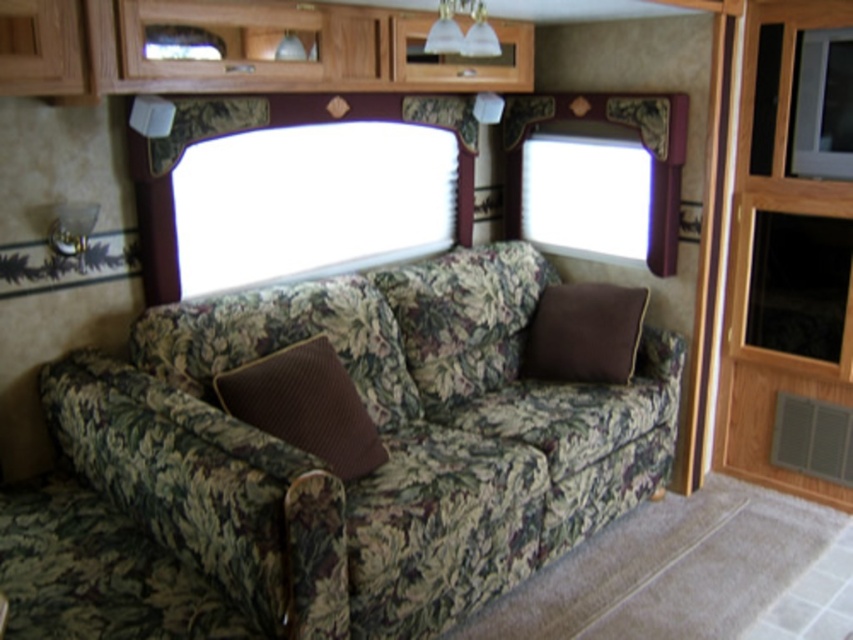
Question: Is floral fabric couch at center positioned in front of brown textured pillow at center?

Choices:
 (A) yes
 (B) no

Answer: (A)

Question: Which point is farther to the camera?

Choices:
 (A) brown cotton pillow at center
 (B) brown textured pillow at center
 (C) floral fabric couch at center

Answer: (A)

Question: Does floral fabric couch at center have a greater width compared to brown cotton pillow at center?

Choices:
 (A) no
 (B) yes

Answer: (B)

Question: Which object is the closest to the brown textured pillow at center?

Choices:
 (A) brown cotton pillow at center
 (B) floral fabric couch at center

Answer: (B)

Question: Is floral fabric couch at center to the left of brown textured pillow at center from the viewer's perspective?

Choices:
 (A) no
 (B) yes

Answer: (A)

Question: Estimate the real-world distances between objects in this image. Which object is closer to the floral fabric couch at center?

Choices:
 (A) brown cotton pillow at center
 (B) brown textured pillow at center

Answer: (B)